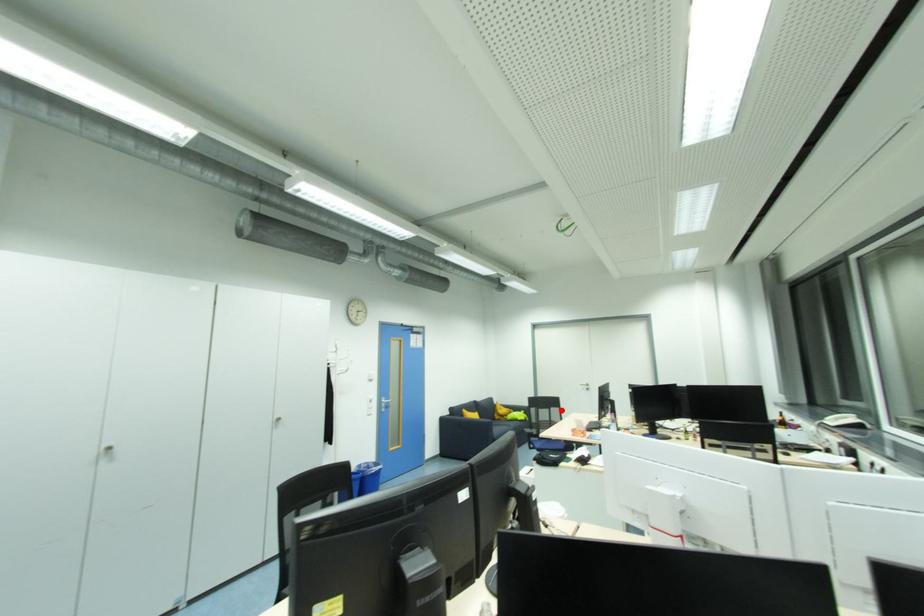
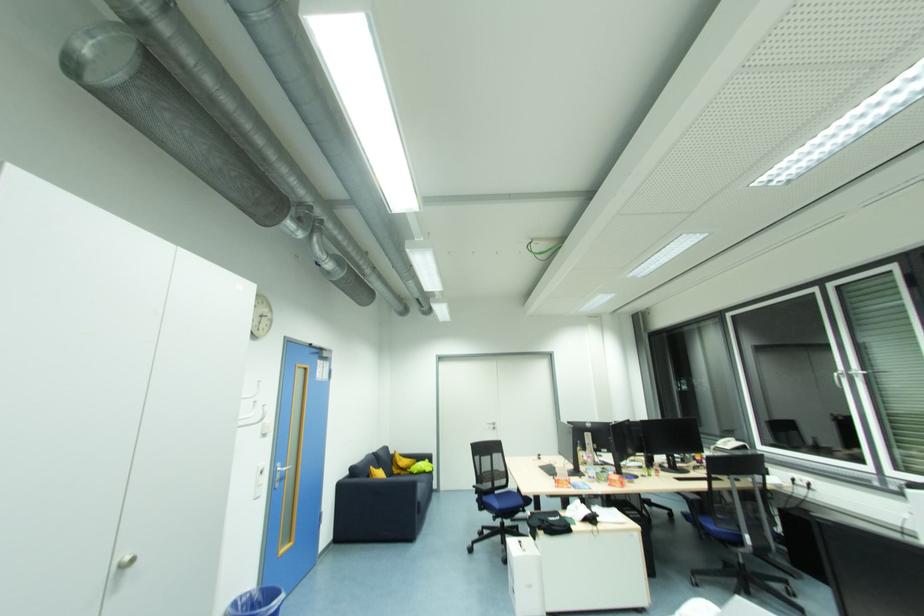
Locate, in the second image, the point that corresponds to the highlighted location in the first image.

(504, 456)